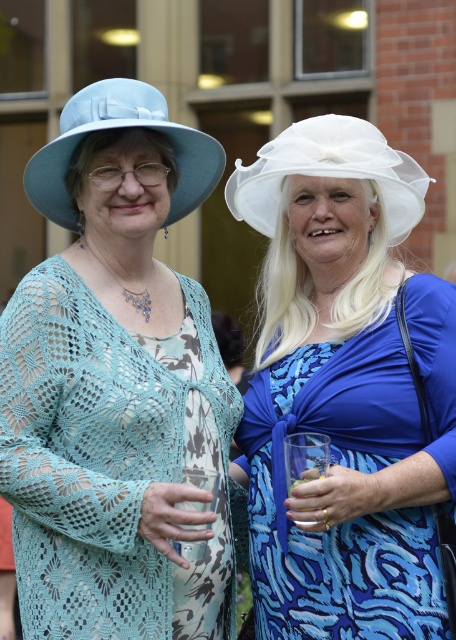
Between white sheer hat at upper center and matte blue fabric hat at upper left, which one appears on the right side from the viewer's perspective?

From the viewer's perspective, white sheer hat at upper center appears more on the right side.

Is white sheer hat at upper center behind matte blue fabric hat at upper left?

Yes, white sheer hat at upper center is behind matte blue fabric hat at upper left.

Which is in front, point (310, 324) or point (74, 132)?

Point (74, 132)

Find the location of a particular element. The height and width of the screenshot is (640, 456). white sheer hat at upper center is located at coordinates (345, 390).

Can you confirm if matte blue hat at left is taller than white sheer fabric hat at upper center?

Yes.

Is matte blue hat at left above white sheer fabric hat at upper center?

No.

Identify the location of matte blue hat at left. The width and height of the screenshot is (456, 640). (117, 387).

Does matte blue hat at left lie in front of white sheer hat at upper center?

That is True.

Describe the element at coordinates (117, 387) in the screenshot. I see `matte blue hat at left` at that location.

The width and height of the screenshot is (456, 640). I want to click on matte blue hat at left, so click(x=117, y=387).